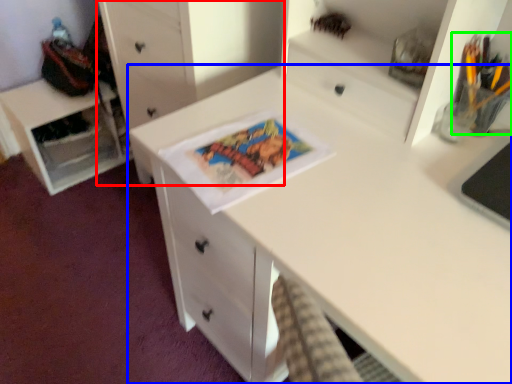
Question: Which object is positioned farthest from chest of drawers (highlighted by a red box)? Select from desk (highlighted by a blue box) and stationery (highlighted by a green box).

Choices:
 (A) desk
 (B) stationery

Answer: (B)